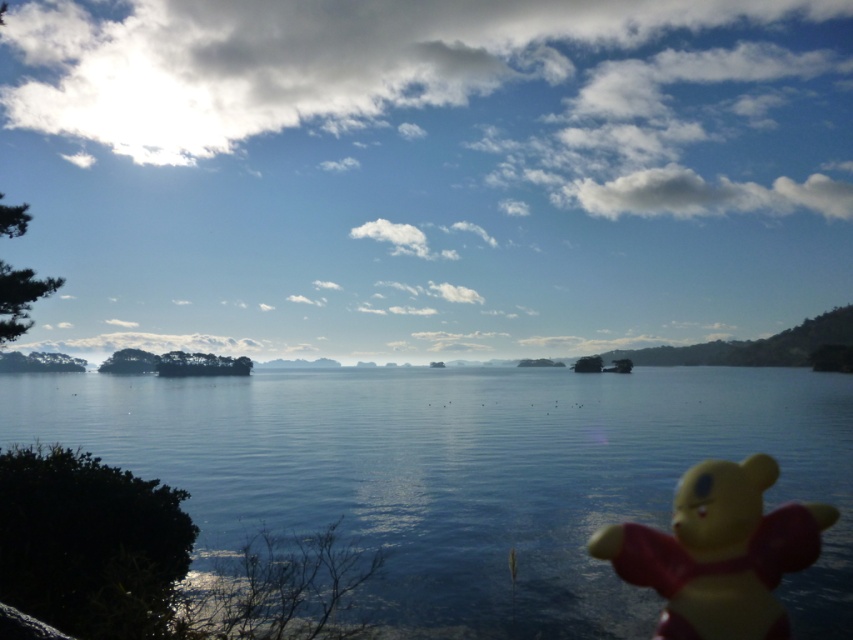
You are a photographer trying to capture a clear shot of the yellow matte bear at lower right and the transparent water at center. Which object is wider in the image?

The transparent water at center might be wider than yellow matte bear at lower right.

You are a photographer trying to capture the yellow matte bear at lower right and the transparent water at center in a single shot. Which object will appear closer to the camera in the final photo?

The transparent water at center will appear closer to the camera in the final photo because it is further to the viewer than the yellow matte bear at lower right.

You are standing at the center of the image and want to walk towards the two points. Which point should you reach first, point (793, 618) or point (691, 516)?

You will reach point (691, 516) first because point (793, 618) is behind it.